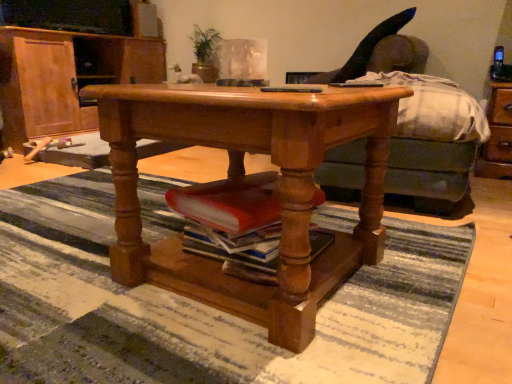
Question: From the image's perspective, relative to wooden table at center, is wooden cabinet at left above or below?

Choices:
 (A) above
 (B) below

Answer: (A)

Question: Is wooden cabinet at left bigger or smaller than wooden table at center?

Choices:
 (A) small
 (B) big

Answer: (B)

Question: Estimate the real-world distances between objects in this image. Which object is closer to the striped rug at center?

Choices:
 (A) wooden table at center
 (B) brown wooden dresser at right
 (C) green leafy plant at upper center
 (D) black leather swivel chair at upper right
 (E) green fabric couch at center

Answer: (A)

Question: Which is nearer to the striped rug at center?

Choices:
 (A) brown wooden dresser at right
 (B) black plastic remote control at center
 (C) wooden table at center
 (D) black leather swivel chair at upper right
 (E) wooden cabinet at left

Answer: (C)